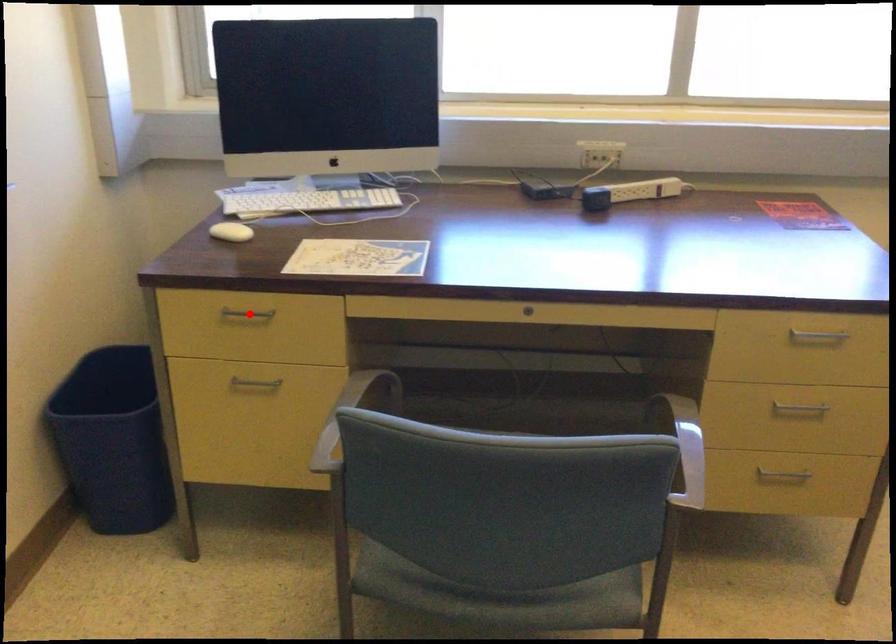
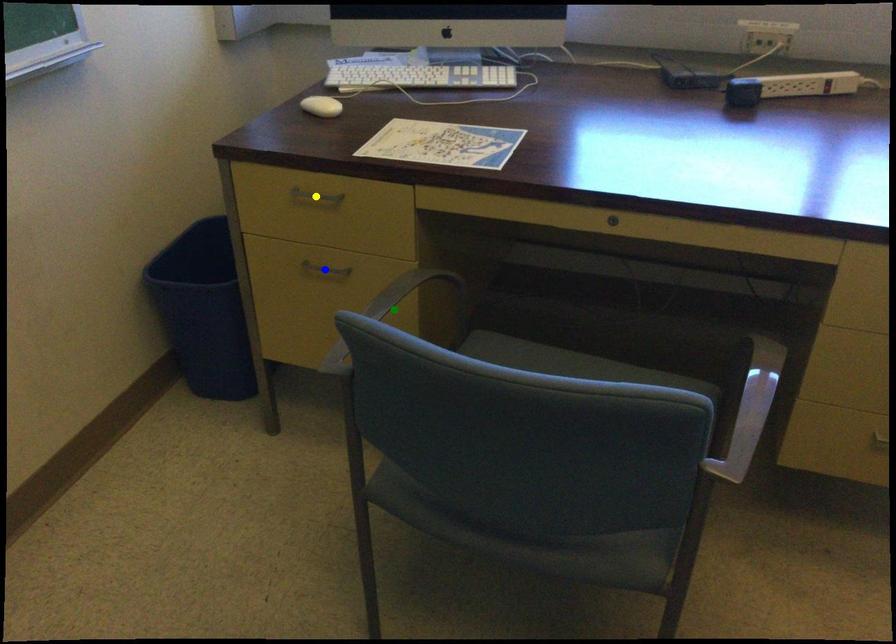
Question: I am providing you with two images of the same scene from different viewpoints. A red point is marked on the first image. You are given multiple points on the second image. In image 2, which mark is for the same physical point as the one in image 1?

Choices:
 (A) blue point
 (B) yellow point
 (C) green point

Answer: (B)